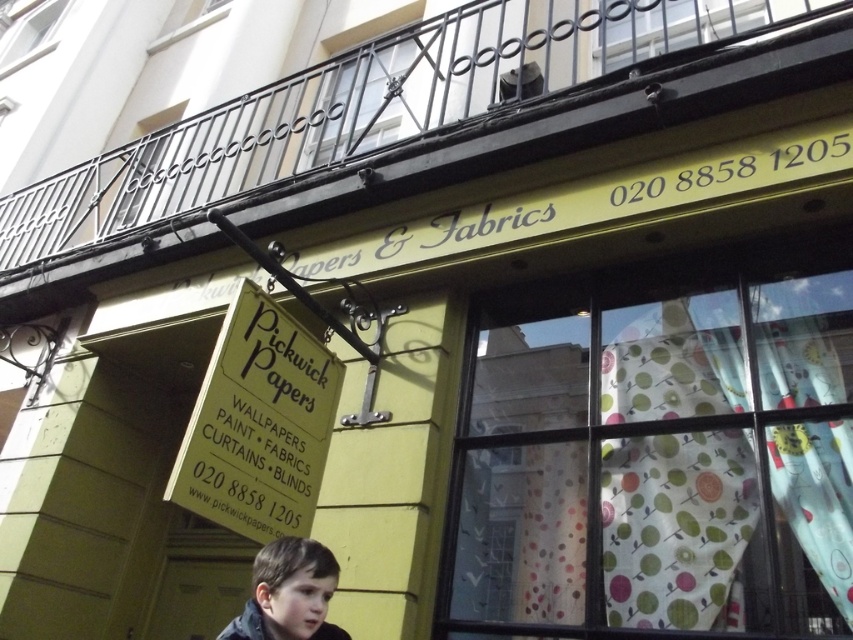
Question: Can you confirm if polka dot fabric at center is positioned to the right of dark brown hair at lower left?

Choices:
 (A) no
 (B) yes

Answer: (B)

Question: Which point is closer to the camera?

Choices:
 (A) polka dot fabric at center
 (B) dark brown hair at lower left

Answer: (B)

Question: Does polka dot fabric at center have a smaller size compared to dark brown hair at lower left?

Choices:
 (A) no
 (B) yes

Answer: (A)

Question: Is polka dot fabric at center to the right of dark brown hair at lower left from the viewer's perspective?

Choices:
 (A) yes
 (B) no

Answer: (A)